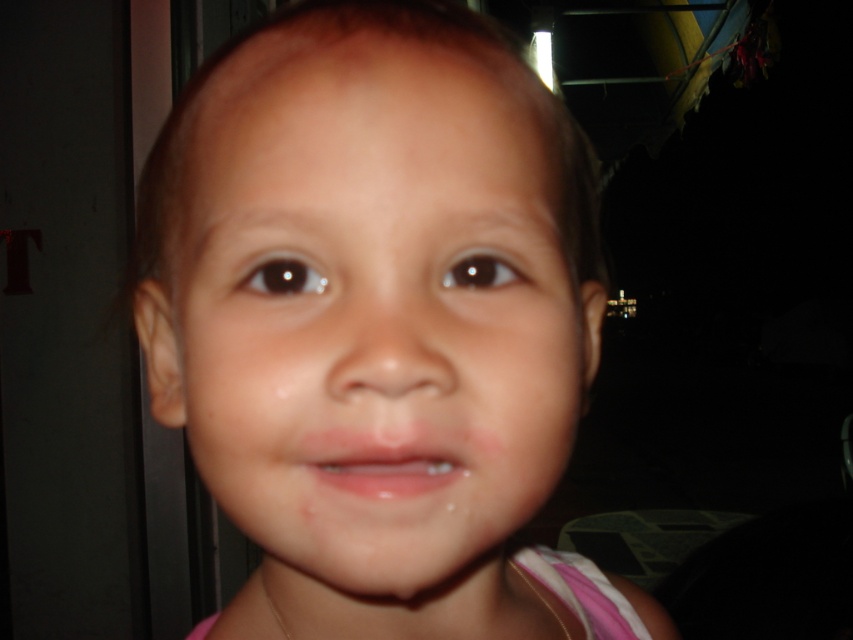
You are a photographer adjusting lighting for a portrait. You notice the smooth skin face at center and glossy pink lips at center in the frame. Which object should you focus the light on to ensure proper exposure, the one closer to the camera or the one further away?

The smooth skin face at center is positioned over glossy pink lips at center, meaning it is closer to the camera. Therefore, you should focus the light on the smooth skin face at center to ensure proper exposure.